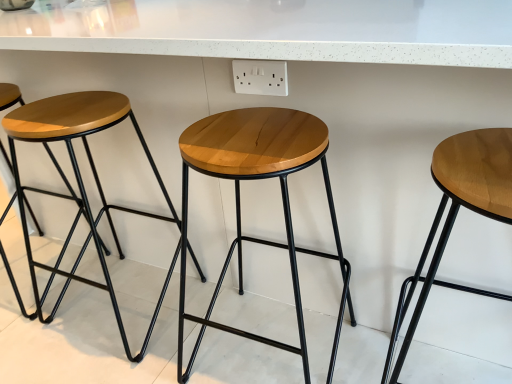
Question: From a real-world perspective, relative to natural wood stool at center, the second stool positioned from the right, is matte wood stool at left, the first stool positioned from the left, vertically above or below?

Choices:
 (A) below
 (B) above

Answer: (B)

Question: Relative to natural wood stool at center, the 3th stool in the left-to-right sequence, is matte wood stool at left, the first stool positioned from the left, in front or behind?

Choices:
 (A) front
 (B) behind

Answer: (B)

Question: Which object is positioned closest to the matte wood stool at left, the 4th stool when ordered from right to left?

Choices:
 (A) natural wood stool at center, the 3th stool in the left-to-right sequence
 (B) light brown wood stool at right, arranged as the 4th stool when viewed from the left
 (C) wooden stool at left, which is the 2th stool from left to right

Answer: (C)

Question: Considering the real-world distances, which object is closest to the wooden stool at left, acting as the third stool starting from the right?

Choices:
 (A) matte wood stool at left, the first stool positioned from the left
 (B) light brown wood stool at right, which is counted as the 1th stool, starting from the right
 (C) natural wood stool at center, the 3th stool in the left-to-right sequence

Answer: (A)